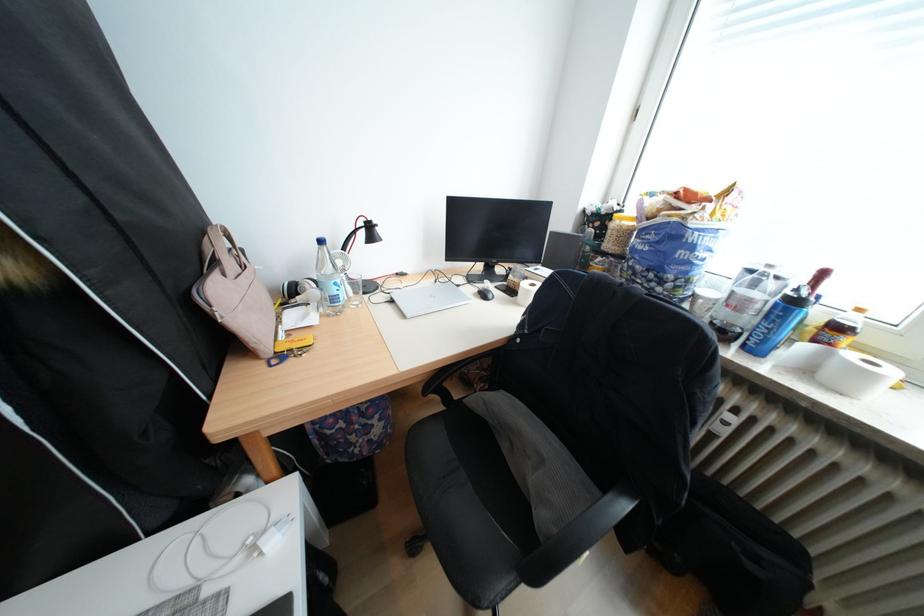
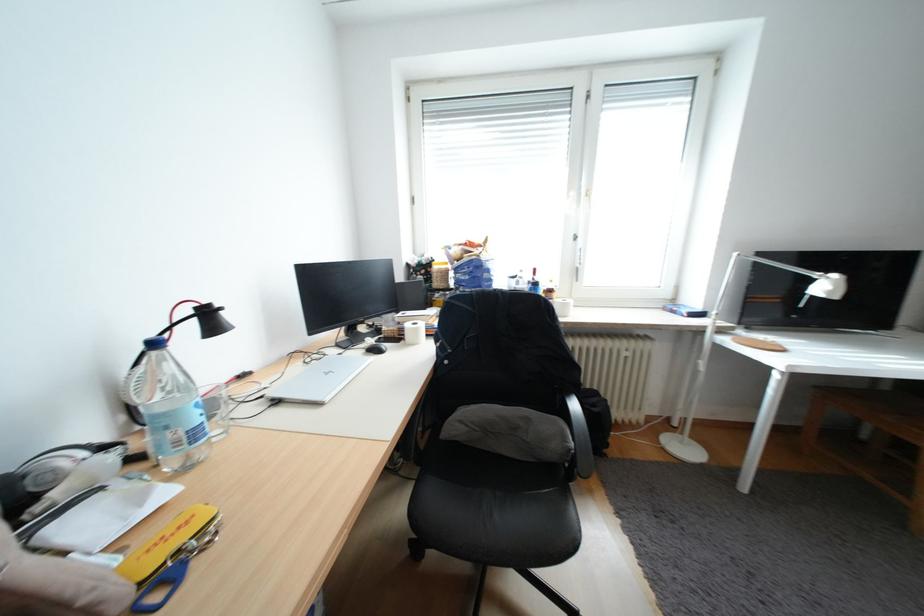
Find the pixel in the second image that matches (x=374, y=235) in the first image.

(202, 328)